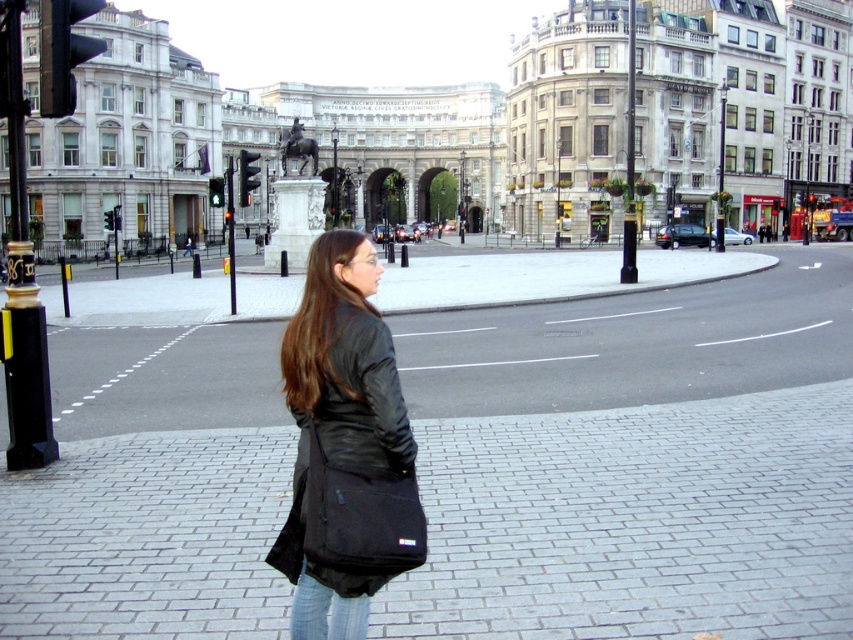
Who is taller, metallic pole at center or black metal traffic light at left?

black metal traffic light at left

Is metallic pole at center to the left of black metal traffic light at left from the viewer's perspective?

Incorrect, metallic pole at center is not on the left side of black metal traffic light at left.

This screenshot has width=853, height=640. What are the coordinates of `metallic pole at center` in the screenshot? It's located at (720, 173).

Is black polished metal pole at left positioned before jeans at lower center?

No, it is not.

This screenshot has height=640, width=853. What do you see at coordinates (21, 275) in the screenshot?
I see `black polished metal pole at left` at bounding box center [21, 275].

At what (x,y) coordinates should I click in order to perform the action: click on black polished metal pole at left. Please return your answer as a coordinate pair (x, y). Looking at the image, I should click on (21, 275).

Consider the image. Who is more distant from viewer, (345, 529) or (18, 56)?

The point (18, 56) is more distant.

Can you confirm if black leather jacket at center is bigger than black polished metal pole at left?

Yes.

Is point (300, 348) more distant than point (28, 260)?

That is False.

The height and width of the screenshot is (640, 853). What are the coordinates of `black leather jacket at center` in the screenshot? It's located at (345, 448).